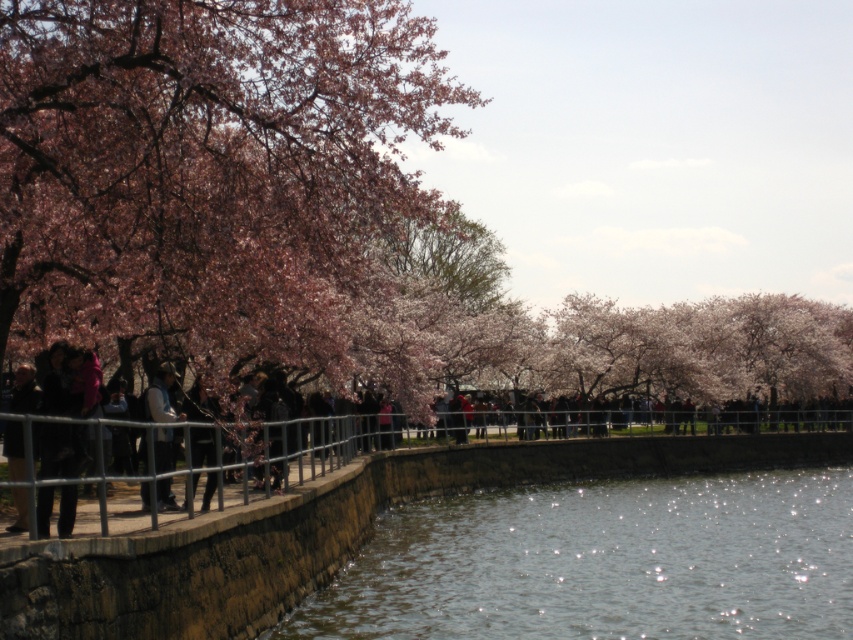
Question: Which is nearer to the clear water at lower center?

Choices:
 (A) dark brown leather jacket at left
 (B) denim jacket at center
 (C) pink blossoms at left

Answer: (C)

Question: Does clear water at lower center have a larger size compared to dark brown leather jacket at left?

Choices:
 (A) yes
 (B) no

Answer: (A)

Question: Can you confirm if pink blossoms at left is positioned to the left of black fabric person at center?

Choices:
 (A) no
 (B) yes

Answer: (A)

Question: Which point is farther to the camera?

Choices:
 (A) denim jacket at center
 (B) clear water at lower center

Answer: (B)

Question: Can you confirm if pink blossoms at left is positioned to the right of clear water at lower center?

Choices:
 (A) no
 (B) yes

Answer: (A)

Question: Which object is farther from the camera taking this photo?

Choices:
 (A) denim jacket at center
 (B) pink blossoms at left
 (C) dark brown leather jacket at left
 (D) clear water at lower center

Answer: (B)